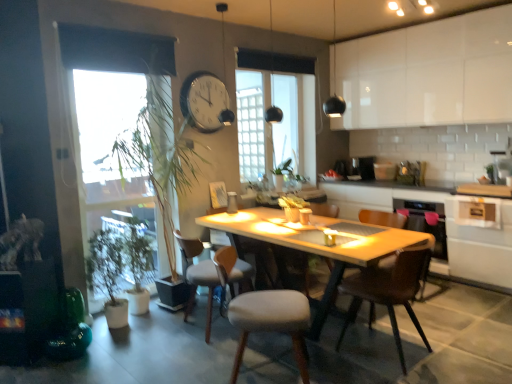
Question: Does white plastic clock at upper center have a smaller size compared to light gray fabric chair at center, the fourth chair when ordered from front to back?

Choices:
 (A) yes
 (B) no

Answer: (A)

Question: From the image's perspective, is white plastic clock at upper center on top of light gray fabric chair at center, the fourth chair when ordered from front to back?

Choices:
 (A) yes
 (B) no

Answer: (A)

Question: Would you say white plastic clock at upper center is a long distance from light gray fabric chair at center, the second chair in the back-to-front sequence?

Choices:
 (A) no
 (B) yes

Answer: (B)

Question: Considering the relative sizes of white plastic clock at upper center and light gray fabric chair at center, the second chair in the back-to-front sequence, in the image provided, is white plastic clock at upper center taller than light gray fabric chair at center, the second chair in the back-to-front sequence,?

Choices:
 (A) no
 (B) yes

Answer: (A)

Question: Is white plastic clock at upper center bigger than light gray fabric chair at center, the second chair in the back-to-front sequence?

Choices:
 (A) no
 (B) yes

Answer: (A)

Question: Considering the positions of green leafy plant at left and white glossy cabinet at lower right, which is counted as the first cabinetry, starting from the bottom, in the image, is green leafy plant at left wider or thinner than white glossy cabinet at lower right, which is counted as the first cabinetry, starting from the bottom,?

Choices:
 (A) thin
 (B) wide

Answer: (A)

Question: From the image's perspective, is green leafy plant at left located above or below white glossy cabinet at lower right, which ranks as the 2th cabinetry in top-to-bottom order?

Choices:
 (A) below
 (B) above

Answer: (A)

Question: In the image, is green leafy plant at left on the left side or the right side of white glossy cabinet at lower right, which is counted as the first cabinetry, starting from the bottom?

Choices:
 (A) right
 (B) left

Answer: (B)

Question: Looking at the image, does green leafy plant at left seem bigger or smaller compared to white glossy cabinet at lower right, which ranks as the 2th cabinetry in top-to-bottom order?

Choices:
 (A) small
 (B) big

Answer: (A)

Question: Considering their positions, is green leafy plant at left located in front of or behind white plastic clock at upper center?

Choices:
 (A) front
 (B) behind

Answer: (A)

Question: Is green leafy plant at left bigger or smaller than white plastic clock at upper center?

Choices:
 (A) big
 (B) small

Answer: (A)

Question: Is point (143, 278) positioned closer to the camera than point (205, 84)?

Choices:
 (A) farther
 (B) closer

Answer: (B)

Question: Is green leafy plant at left wider or thinner than white plastic clock at upper center?

Choices:
 (A) thin
 (B) wide

Answer: (B)

Question: Is clear glass window at center inside the boundaries of white glossy counter at center, or outside?

Choices:
 (A) inside
 (B) outside

Answer: (B)

Question: Is clear glass window at center to the left or to the right of white glossy counter at center in the image?

Choices:
 (A) right
 (B) left

Answer: (B)